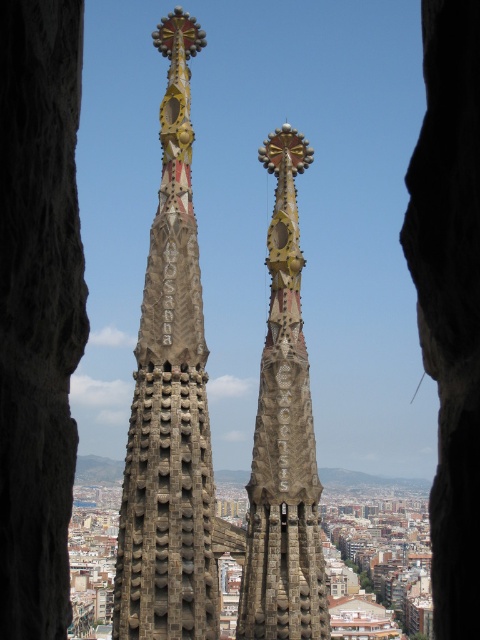
You are standing at the center of the viewing platform and want to take a photo of the rustic stone spire at center. Which direction should you face to ensure the spire is in the center of your camera frame?

A: The rustic stone spire at center is already positioned at the center of the scene, so facing directly ahead will center it in your camera frame.

You are standing on a viewing platform overlooking the Sagrada Familia spires. You notice two points marked on the spires at coordinates point (195,577) and point (292,605). Which point is closer to your current position?

Point (195,577) is in front of point (292,605), so it is closer to your current position on the viewing platform.